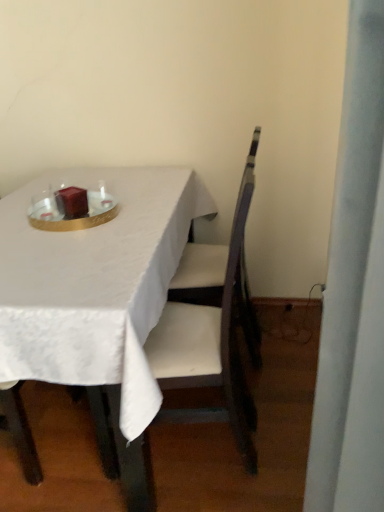
Question: Does wooden chair at center have a smaller size compared to white fabric table at center?

Choices:
 (A) yes
 (B) no

Answer: (A)

Question: Is wooden chair at center oriented towards white fabric table at center?

Choices:
 (A) no
 (B) yes

Answer: (B)

Question: Does wooden chair at center lie in front of white fabric table at center?

Choices:
 (A) yes
 (B) no

Answer: (B)

Question: Is wooden chair at center far from white fabric table at center?

Choices:
 (A) no
 (B) yes

Answer: (A)

Question: Does wooden chair at center come behind white fabric table at center?

Choices:
 (A) no
 (B) yes

Answer: (B)

Question: Is white fabric table at center situated inside wooden chair at center or outside?

Choices:
 (A) inside
 (B) outside

Answer: (B)

Question: Relative to wooden chair at center, is white fabric table at center in front or behind?

Choices:
 (A) behind
 (B) front

Answer: (B)

Question: In terms of size, does white fabric table at center appear bigger or smaller than wooden chair at center?

Choices:
 (A) big
 (B) small

Answer: (A)

Question: From the image's perspective, is white fabric table at center above or below wooden chair at center?

Choices:
 (A) below
 (B) above

Answer: (A)

Question: Considering the relative positions of shiny gold tray at center and wooden chair at center in the image provided, is shiny gold tray at center to the left or to the right of wooden chair at center?

Choices:
 (A) left
 (B) right

Answer: (A)

Question: In terms of size, does shiny gold tray at center appear bigger or smaller than wooden chair at center?

Choices:
 (A) big
 (B) small

Answer: (B)

Question: Is shiny gold tray at center inside or outside of wooden chair at center?

Choices:
 (A) inside
 (B) outside

Answer: (B)

Question: From the image's perspective, is shiny gold tray at center located above or below wooden chair at center?

Choices:
 (A) above
 (B) below

Answer: (A)

Question: From the image's perspective, is matte brown candle at center positioned above or below shiny gold tray at center?

Choices:
 (A) above
 (B) below

Answer: (A)

Question: Is matte brown candle at center to the left or to the right of shiny gold tray at center in the image?

Choices:
 (A) right
 (B) left

Answer: (B)